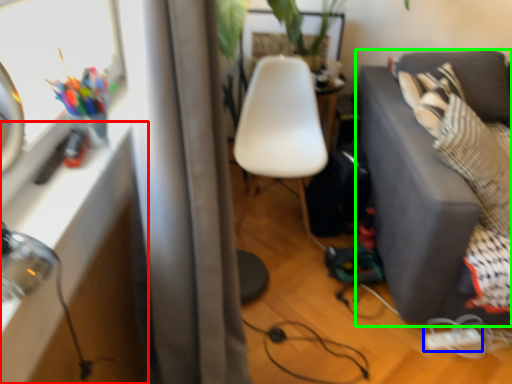
Question: Which object is the farthest from table (highlighted by a red box)? Choose among these: extension cord (highlighted by a blue box) or studio couch (highlighted by a green box).

Choices:
 (A) extension cord
 (B) studio couch

Answer: (A)